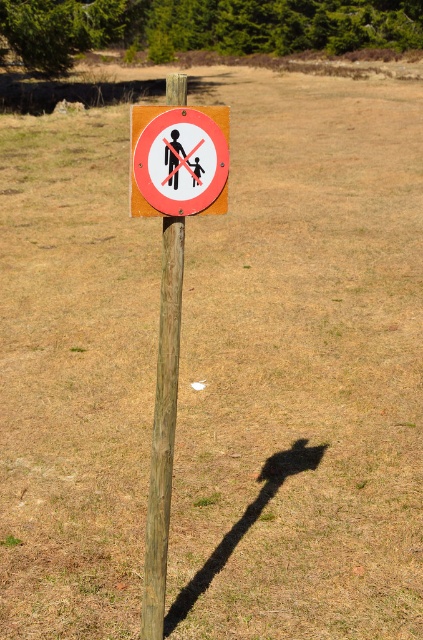
Question: Is red plastic sign at center below wooden post at center?

Choices:
 (A) no
 (B) yes

Answer: (A)

Question: Can you confirm if red plastic sign at center is thinner than wooden post at center?

Choices:
 (A) yes
 (B) no

Answer: (B)

Question: Among these points, which one is farthest from the camera?

Choices:
 (A) coord(156,476)
 (B) coord(145,148)

Answer: (A)

Question: Is red plastic sign at center above wooden post at center?

Choices:
 (A) no
 (B) yes

Answer: (B)

Question: Which object appears closest to the camera in this image?

Choices:
 (A) red plastic sign at center
 (B) wooden post at center

Answer: (A)